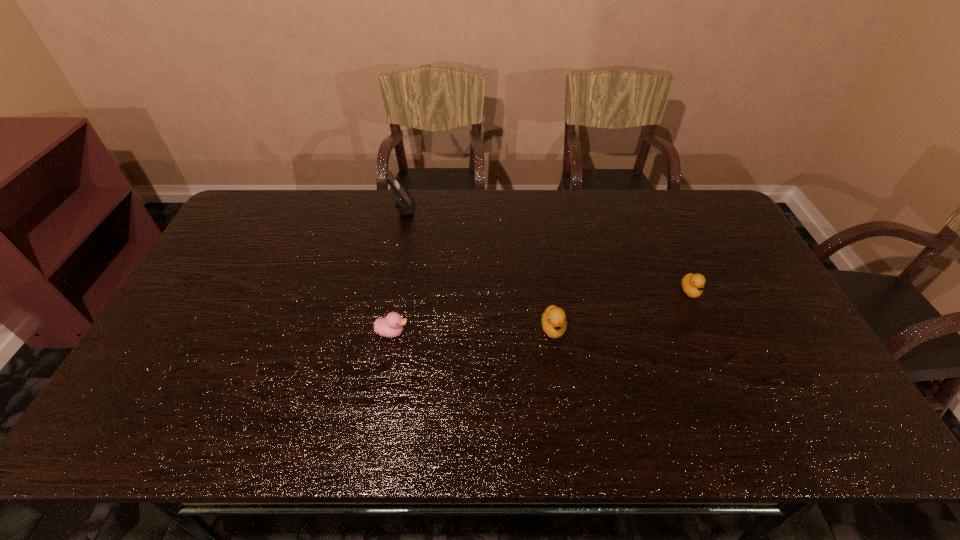
At what (x,y) coordinates should I click in order to perform the action: click on vacant area in the image that satisfies the following two spatial constraints: 1. facing forward on the second duckling from right to left; 2. on the front-facing side of the leftmost duckling. Please return your answer as a coordinate pair (x, y). Looking at the image, I should click on (554, 333).

What are the coordinates of `free region that satisfies the following two spatial constraints: 1. facing forward on the second duckling from right to left; 2. on the front-facing side of the leftmost duckling` in the screenshot? It's located at (554, 333).